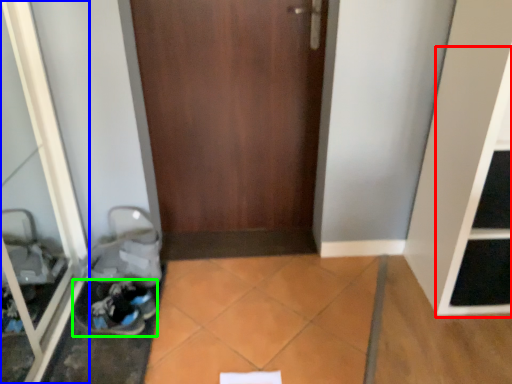
Question: Based on their relative distances, which object is nearer to shelf (highlighted by a red box)? Choose from glass door (highlighted by a blue box) and footwear (highlighted by a green box).

Choices:
 (A) glass door
 (B) footwear

Answer: (B)